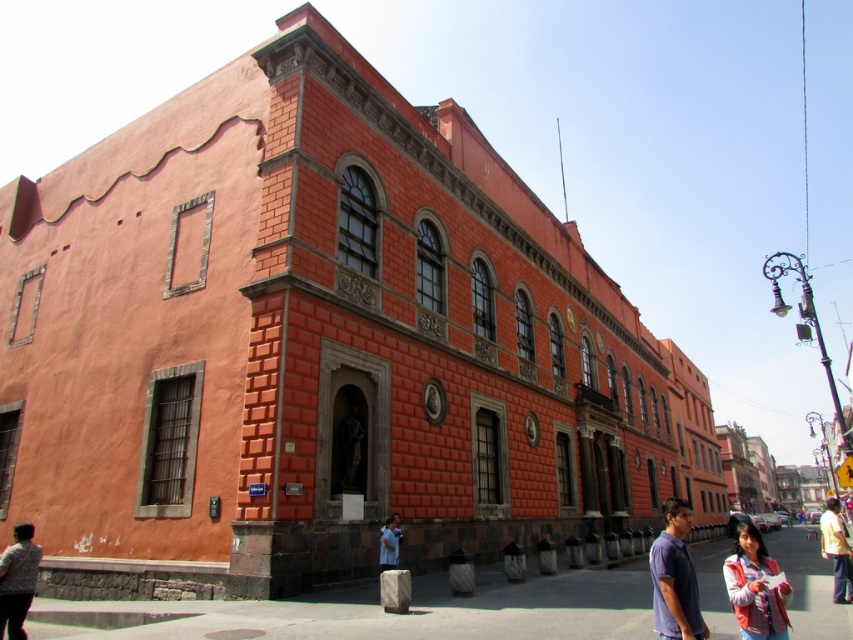
Does purple cotton shirt at lower right appear on the left side of vivid pink jacket at lower right?

Indeed, purple cotton shirt at lower right is positioned on the left side of vivid pink jacket at lower right.

Between purple cotton shirt at lower right and vivid pink jacket at lower right, which one has more height?

vivid pink jacket at lower right

Is point (682, 579) closer to camera compared to point (735, 611)?

No, it is not.

Identify the location of purple cotton shirt at lower right. (674, 577).

Is vivid pink jacket at lower right taller than floral fabric blouse at lower left?

Yes, vivid pink jacket at lower right is taller than floral fabric blouse at lower left.

Is point (751, 582) positioned in front of point (18, 605)?

Yes, point (751, 582) is closer to viewer.

Who is more distant from viewer, (746, 600) or (3, 557)?

Positioned behind is point (3, 557).

You are a GUI agent. You are given a task and a screenshot of the screen. Output one action in this format:
    pyautogui.click(x=<x>, y=<y>)
    Task: Click on the vivid pink jacket at lower right
    
    Given the screenshot: What is the action you would take?
    pyautogui.click(x=755, y=588)

Can you confirm if floral fabric blouse at lower left is smaller than blue denim shirt at lower center?

No.

Can you confirm if floral fabric blouse at lower left is taller than blue denim shirt at lower center?

Yes, floral fabric blouse at lower left is taller than blue denim shirt at lower center.

Identify the location of floral fabric blouse at lower left. Image resolution: width=853 pixels, height=640 pixels. (16, 579).